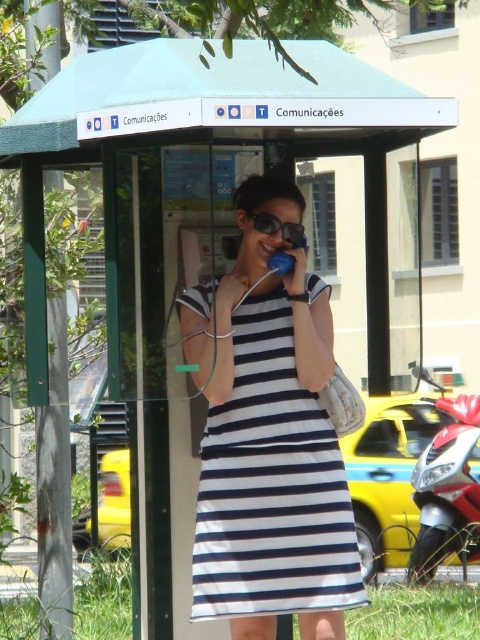
Question: Is navy blue striped dress at center smaller than sunglasses at center?

Choices:
 (A) no
 (B) yes

Answer: (A)

Question: Among these objects, which one is nearest to the camera?

Choices:
 (A) sunglasses at center
 (B) navy blue striped dress at center
 (C) teal plastic canopy at upper center

Answer: (C)

Question: Which is nearer to the teal plastic canopy at upper center?

Choices:
 (A) sunglasses at center
 (B) navy blue striped dress at center

Answer: (A)

Question: Does teal plastic canopy at upper center have a greater width compared to sunglasses at center?

Choices:
 (A) yes
 (B) no

Answer: (A)

Question: Does navy blue striped dress at center have a greater width compared to teal plastic canopy at upper center?

Choices:
 (A) no
 (B) yes

Answer: (A)

Question: Among these objects, which one is farthest from the camera?

Choices:
 (A) sunglasses at center
 (B) navy blue striped dress at center

Answer: (A)